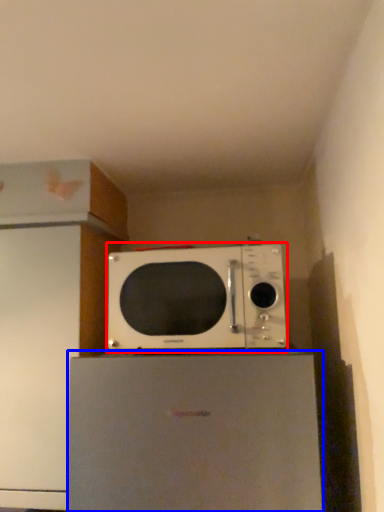
Question: Which point is further to the camera, microwave oven (highlighted by a red box) or appliance (highlighted by a blue box)?

Choices:
 (A) microwave oven
 (B) appliance

Answer: (A)